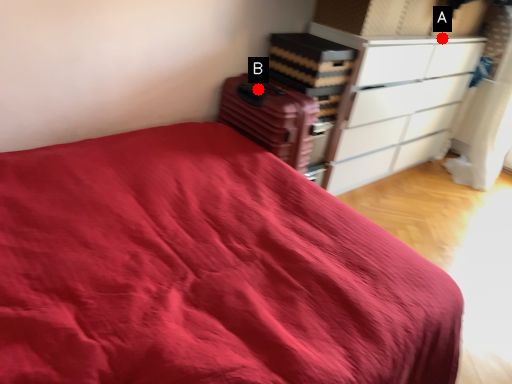
Question: Two points are circled on the image, labeled by A and B beside each circle. Among these points, which one is nearest to the camera?

Choices:
 (A) A is closer
 (B) B is closer

Answer: (B)